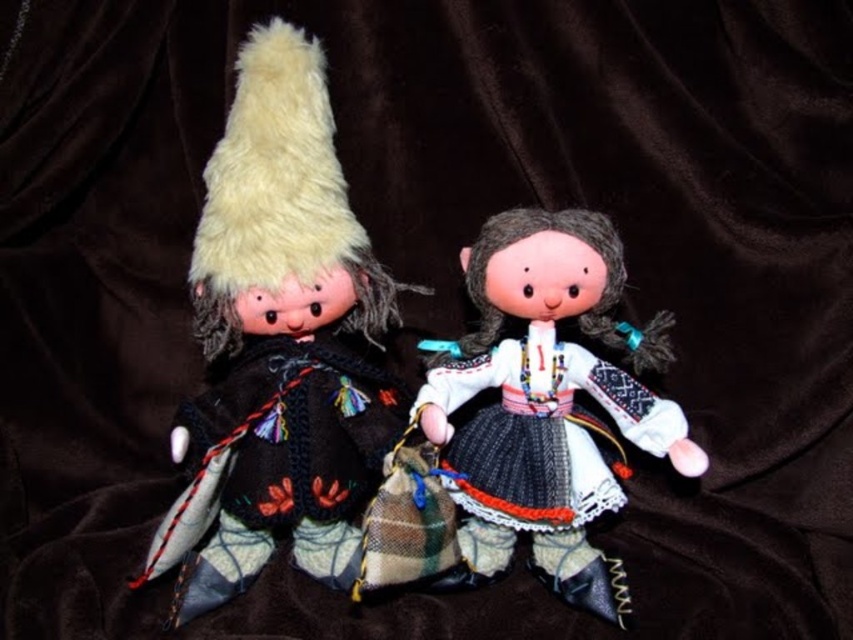
Does point (602, 493) come behind point (517, 388)?

No, it is in front of (517, 388).

Which is more to the left, white fabric doll at center or knitted wool dress at center?

knitted wool dress at center is more to the left.

Locate an element on the screen. white fabric doll at center is located at coordinates click(x=547, y=404).

This screenshot has width=853, height=640. I want to click on white fabric doll at center, so click(x=547, y=404).

Between woolen sweater at left and knitted wool dress at center, which one is positioned lower?

Positioned lower is woolen sweater at left.

Does woolen sweater at left have a greater height compared to knitted wool dress at center?

Indeed, woolen sweater at left has a greater height compared to knitted wool dress at center.

The width and height of the screenshot is (853, 640). Find the location of `woolen sweater at left`. woolen sweater at left is located at coordinates [281, 444].

In the scene shown: Who is shorter, fuzzy woolen hat at left or white fabric doll at center?

With less height is white fabric doll at center.

Does point (210, 456) come farther from viewer compared to point (604, 278)?

No.

Is point (270, 38) less distant than point (563, 380)?

Yes, point (270, 38) is in front of point (563, 380).

Identify the location of fuzzy woolen hat at left. This screenshot has height=640, width=853. (277, 344).